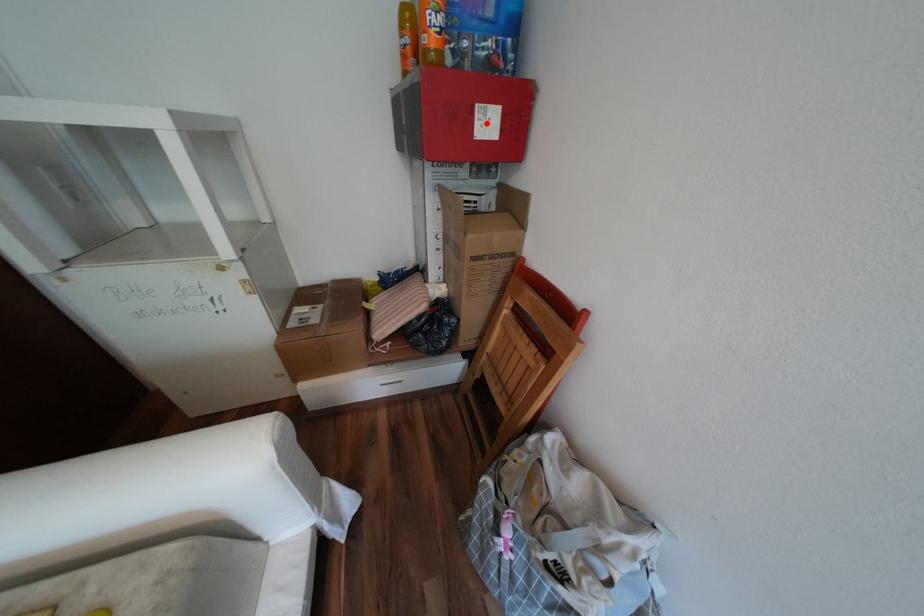
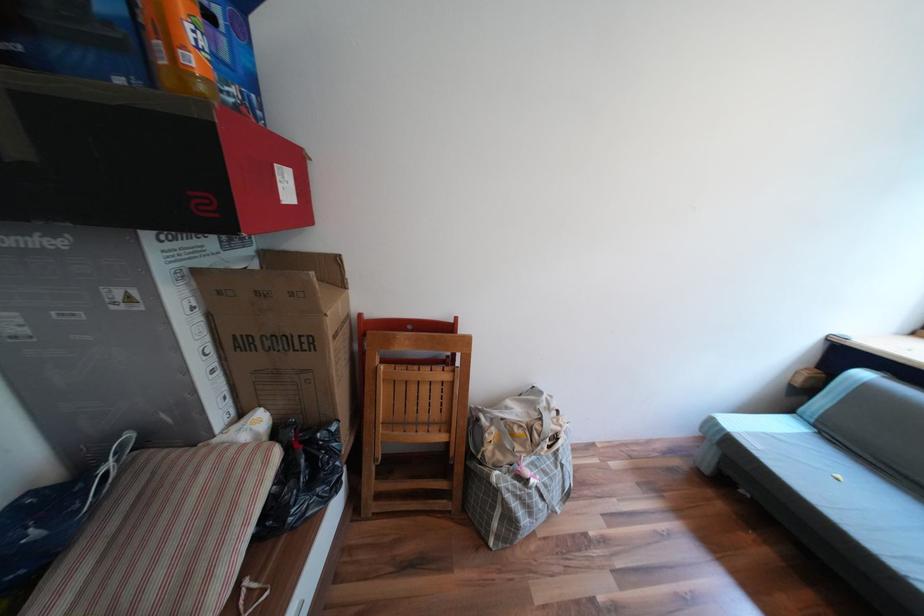
The point at the highlighted location is marked in the first image. Where is the corresponding point in the second image?

(289, 185)